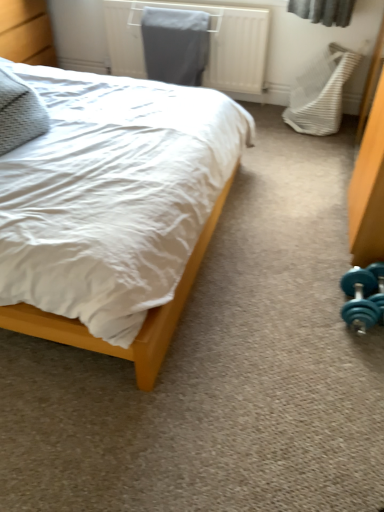
Question: Is white textured swivel chair at right at the back of metallic gray radiator at upper center?

Choices:
 (A) no
 (B) yes

Answer: (A)

Question: Is metallic gray radiator at upper center at the right side of white textured swivel chair at right?

Choices:
 (A) yes
 (B) no

Answer: (B)

Question: Considering the relative sizes of metallic gray radiator at upper center and white textured swivel chair at right in the image provided, is metallic gray radiator at upper center taller than white textured swivel chair at right?

Choices:
 (A) yes
 (B) no

Answer: (B)

Question: Does metallic gray radiator at upper center have a smaller size compared to white textured swivel chair at right?

Choices:
 (A) yes
 (B) no

Answer: (B)

Question: Can you confirm if metallic gray radiator at upper center is positioned to the left of white textured swivel chair at right?

Choices:
 (A) no
 (B) yes

Answer: (B)

Question: Considering their positions, is teal rubber dumbbell at lower right located in front of or behind white textured swivel chair at right?

Choices:
 (A) behind
 (B) front

Answer: (B)

Question: Based on their sizes in the image, would you say teal rubber dumbbell at lower right is bigger or smaller than white textured swivel chair at right?

Choices:
 (A) small
 (B) big

Answer: (A)

Question: Looking at their shapes, would you say teal rubber dumbbell at lower right is wider or thinner than white textured swivel chair at right?

Choices:
 (A) wide
 (B) thin

Answer: (B)

Question: From a real-world perspective, is teal rubber dumbbell at lower right physically located above or below white textured swivel chair at right?

Choices:
 (A) below
 (B) above

Answer: (A)

Question: Considering the positions of point 28,113 and point 334,74, is point 28,113 closer or farther from the camera than point 334,74?

Choices:
 (A) closer
 (B) farther

Answer: (A)

Question: From a real-world perspective, is textured gray pillow at left above or below white textured swivel chair at right?

Choices:
 (A) above
 (B) below

Answer: (A)

Question: From the image's perspective, is textured gray pillow at left above or below white textured swivel chair at right?

Choices:
 (A) above
 (B) below

Answer: (B)

Question: Based on their sizes in the image, would you say textured gray pillow at left is bigger or smaller than white textured swivel chair at right?

Choices:
 (A) big
 (B) small

Answer: (B)

Question: Is wooden bed at left in front of or behind white textured swivel chair at right in the image?

Choices:
 (A) front
 (B) behind

Answer: (A)

Question: From a real-world perspective, is wooden bed at left positioned above or below white textured swivel chair at right?

Choices:
 (A) above
 (B) below

Answer: (A)